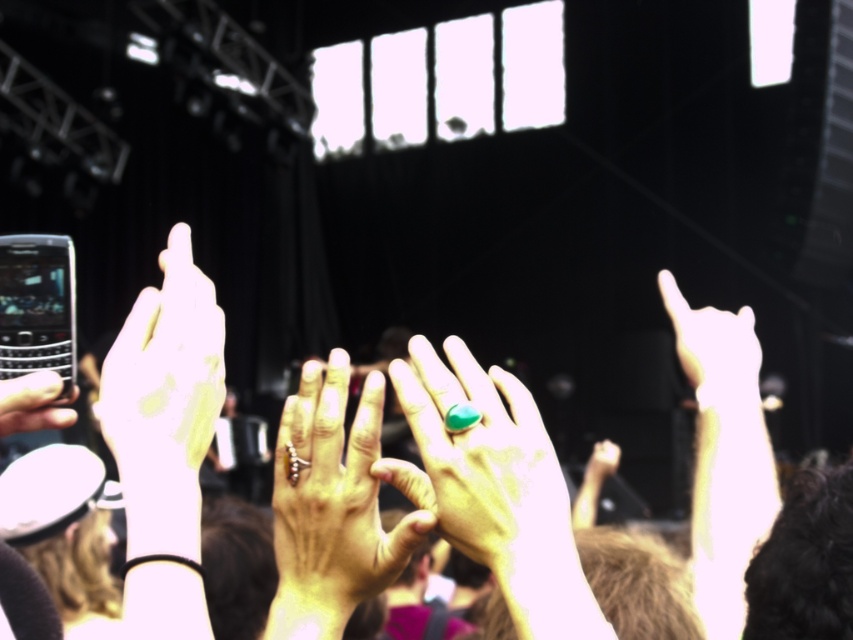
Question: Does matte gold ring at center appear on the left side of shiny gold ring at upper right?

Choices:
 (A) yes
 (B) no

Answer: (A)

Question: Which point appears closest to the camera in this image?

Choices:
 (A) (705, 376)
 (B) (518, 481)
 (C) (0, 392)

Answer: (B)

Question: Considering the real-world distances, which object is closest to the black glossy phone at left?

Choices:
 (A) yellow matte ring at left
 (B) silver metallic ring at center

Answer: (A)

Question: Can you confirm if yellow matte ring at left is positioned below silver metallic ring at center?

Choices:
 (A) yes
 (B) no

Answer: (B)

Question: Does matte gold ring at center have a larger size compared to yellow matte ring at left?

Choices:
 (A) yes
 (B) no

Answer: (A)

Question: Which is nearer to the matte gold ring at center?

Choices:
 (A) yellow matte ring at left
 (B) black glossy phone at left

Answer: (A)